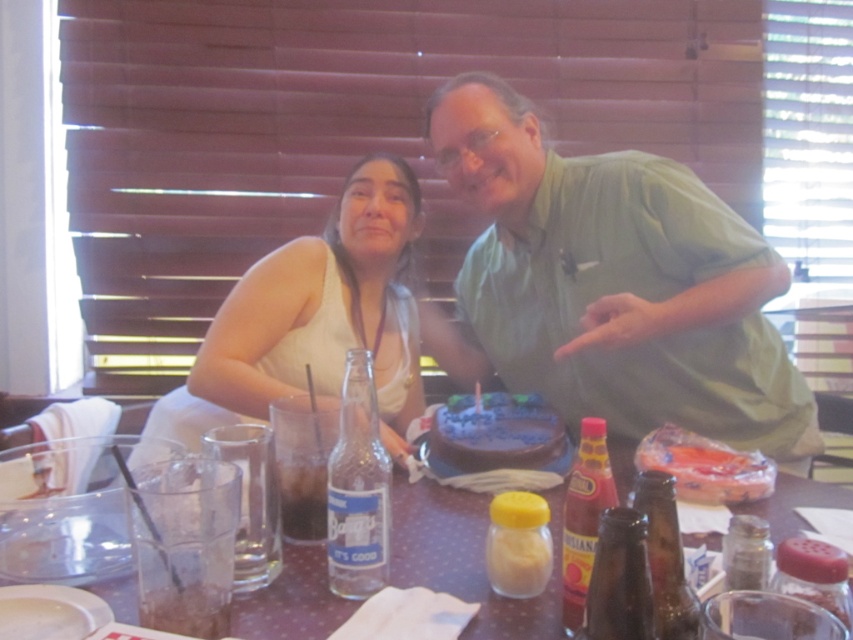
Question: Which object appears farthest from the camera in this image?

Choices:
 (A) green cotton shirt at center
 (B) blue frosted cake at center
 (C) brown speckled table at center

Answer: (A)

Question: Which object appears closest to the camera in this image?

Choices:
 (A) brown speckled table at center
 (B) green cotton shirt at center

Answer: (A)

Question: Is white fabric shirt at left further to camera compared to brown speckled table at center?

Choices:
 (A) no
 (B) yes

Answer: (B)

Question: Is green cotton shirt at center positioned behind blue frosted cake at center?

Choices:
 (A) no
 (B) yes

Answer: (B)

Question: Which point is farther to the camera?

Choices:
 (A) brown speckled table at center
 (B) green cotton shirt at center
 (C) white fabric shirt at left
 (D) blue frosted cake at center

Answer: (C)

Question: Does white fabric shirt at left appear over brown speckled table at center?

Choices:
 (A) no
 (B) yes

Answer: (B)